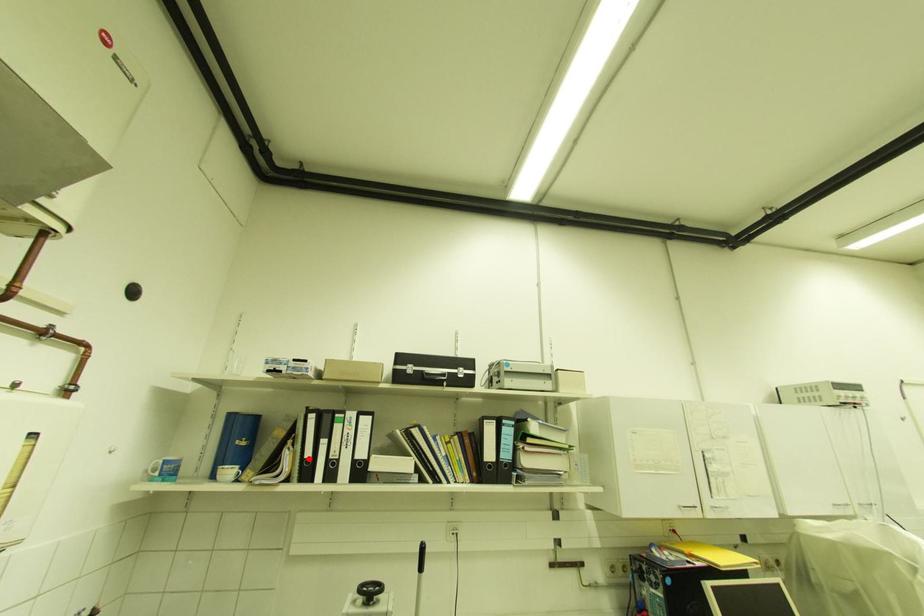
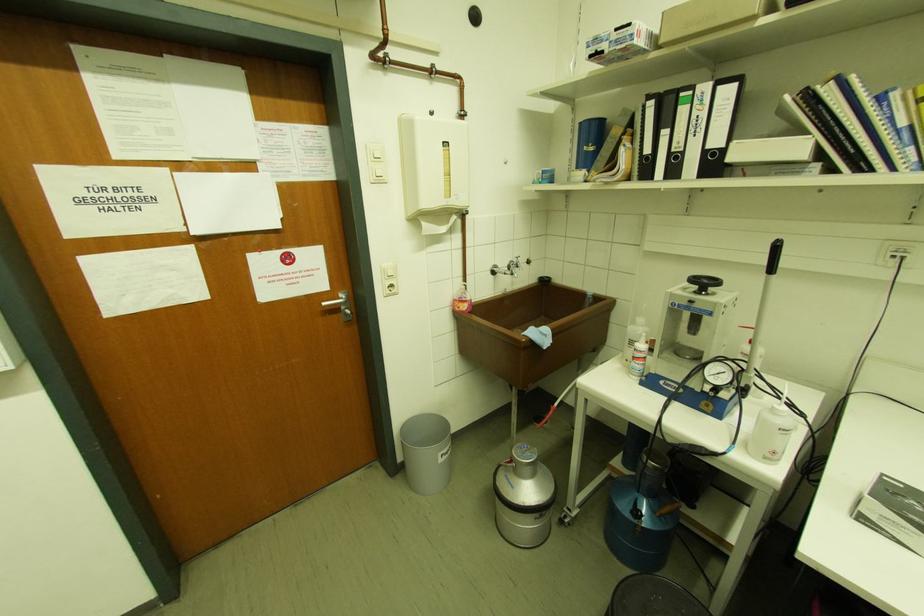
The point at the highlighted location is marked in the first image. Where is the corresponding point in the second image?

(648, 155)